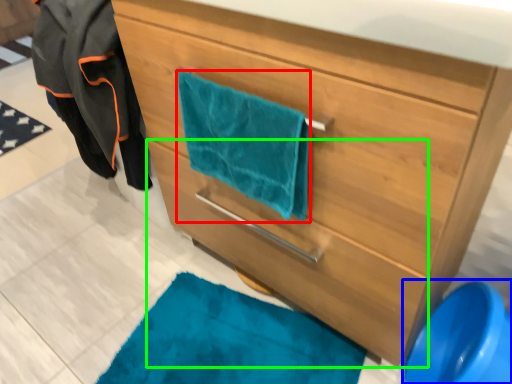
Question: Which is nearer to the beach towel (highlighted by a red box)? teal (highlighted by a blue box) or drawer (highlighted by a green box).

Choices:
 (A) teal
 (B) drawer

Answer: (B)